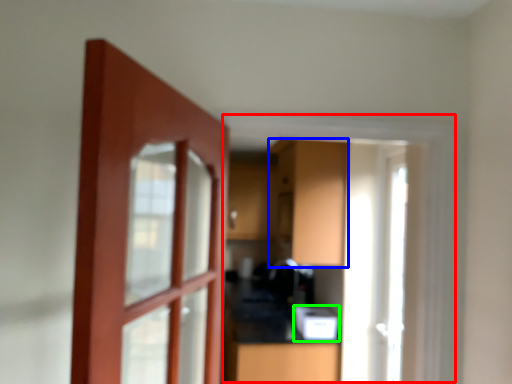
Question: Estimate the real-world distances between objects in this image. Which object is closer to window frame (highlighted by a red box), cabinetry (highlighted by a blue box) or appliance (highlighted by a green box)?

Choices:
 (A) cabinetry
 (B) appliance

Answer: (A)